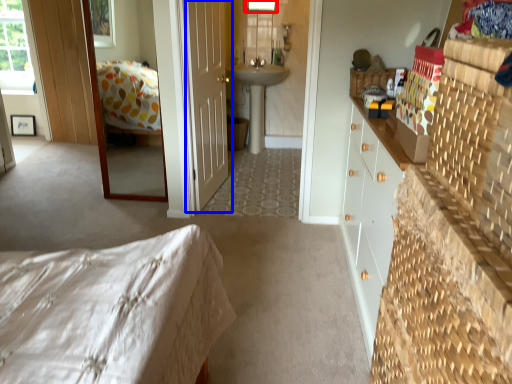
Question: Among these objects, which one is nearest to the camera, window (highlighted by a red box) or door (highlighted by a blue box)?

Choices:
 (A) window
 (B) door

Answer: (B)